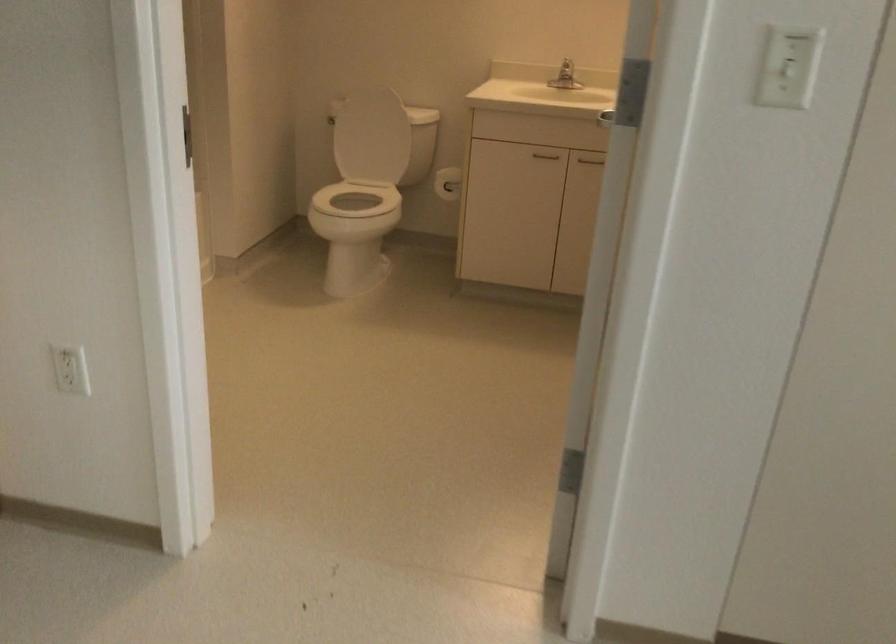
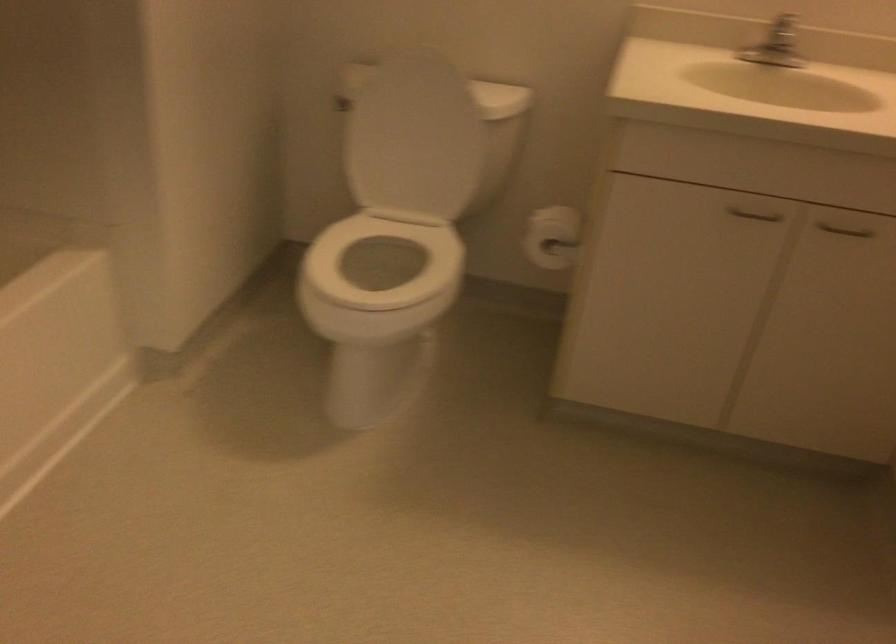
Find the pixel in the second image that matches [332,124] in the first image.

(340, 104)